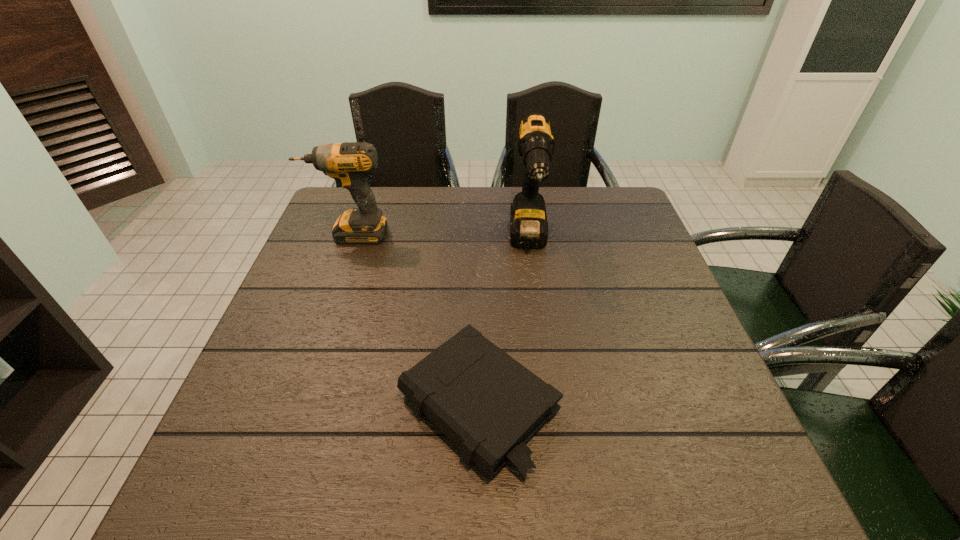
Find the location of `free space between the leftmost object and the shortest object`. free space between the leftmost object and the shortest object is located at coordinates (414, 319).

What are the coordinates of `free spot between the nearest object and the right drill` in the screenshot? It's located at (503, 323).

What are the coordinates of `unoccupied position between the Bible and the leftmost object` in the screenshot? It's located at (414, 319).

Where is `vacant space in between the left drill and the nearest object`? vacant space in between the left drill and the nearest object is located at coordinates (414, 319).

Image resolution: width=960 pixels, height=540 pixels. I want to click on free space between the nearest object and the second shortest object, so click(414, 319).

I want to click on object that is the second closest one to the shortest object, so click(x=348, y=164).

Select which object is the second closest to the nearest object. Please provide its 2D coordinates. Your answer should be formatted as a tuple, i.e. [(x, y)], where the tuple contains the x and y coordinates of a point satisfying the conditions above.

[(348, 164)]

Where is `free location that satisfies the following two spatial constraints: 1. on the back side of the Bible; 2. with the drill bit of the left drill facing forward`? free location that satisfies the following two spatial constraints: 1. on the back side of the Bible; 2. with the drill bit of the left drill facing forward is located at coordinates (479, 234).

Where is `vacant space that satisfies the following two spatial constraints: 1. on the back side of the nearest object; 2. with the drill bit of the second tallest object facing forward`? vacant space that satisfies the following two spatial constraints: 1. on the back side of the nearest object; 2. with the drill bit of the second tallest object facing forward is located at coordinates (479, 234).

I want to click on vacant position in the image that satisfies the following two spatial constraints: 1. on the back side of the Bible; 2. with the drill bit of the shorter drill facing forward, so click(479, 234).